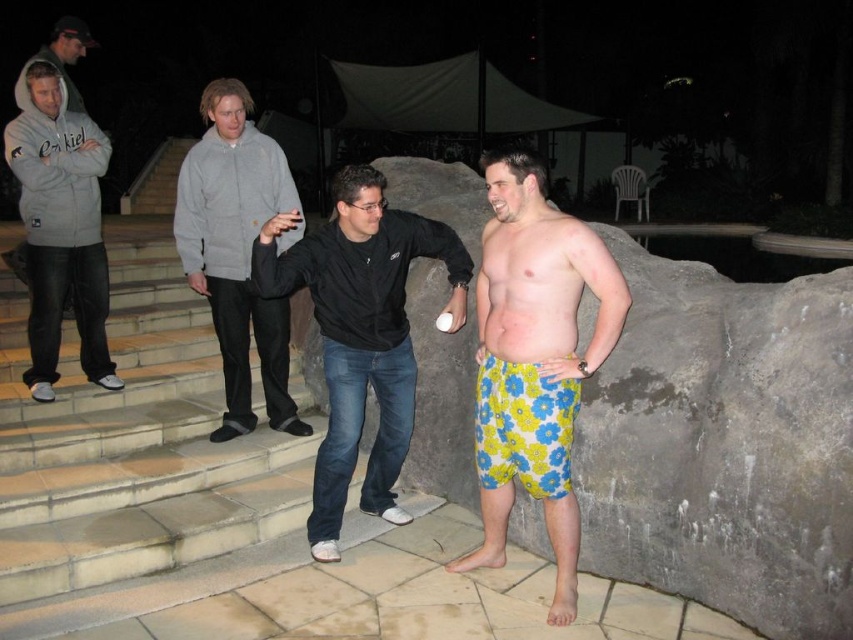
You are a photographer trying to capture a group photo of the gray fleece hoodie at left and the matte gray hoodie at left. Since you want them to be side by side, which one should be on the left in the photo?

The matte gray hoodie at left should be on the left in the photo because the gray fleece hoodie at left is positioned on the right side of it.

You are standing on the patio and want to place a small potted plant between the two points, point (549, 456) and point (76, 113). Which point should the plant be closer to if you want it to be nearer to the viewer?

The plant should be placed closer to point (549, 456) because it is closer to the viewer than point (76, 113).

You are standing on the patio and want to place a small decorative item exactly at the point labeled as point (x=61, y=227). Which object from the scene should you place it on?

You should place the decorative item on the matte gray hoodie at left because the point (x=61, y=227) is located on that object.